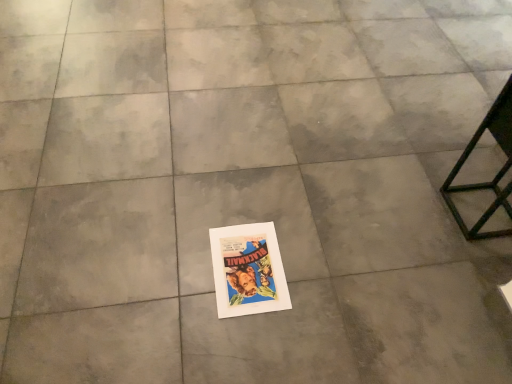
Where is `spots to the right of vibrant paper poster at center`? Image resolution: width=512 pixels, height=384 pixels. spots to the right of vibrant paper poster at center is located at coordinates (322, 274).